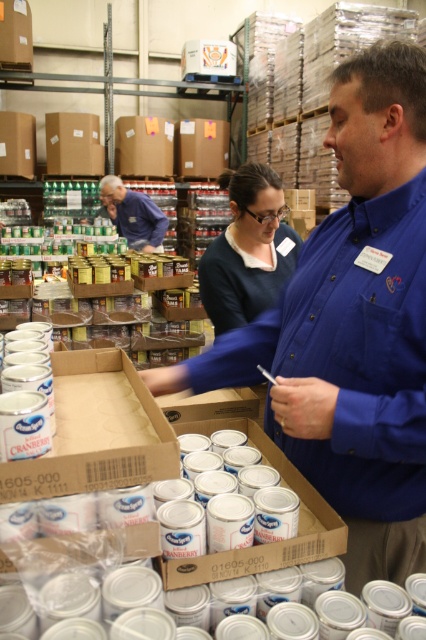
You are a new volunteer at the warehouse and need to identify the volunteers based on their clothing. Which volunteer has clothing with a smaller size between the dark blue sweater at center and the matte blue shirt at center?

The dark blue sweater at center is smaller than the matte blue shirt at center, so the volunteer wearing the dark blue sweater at center has clothing with a smaller size.